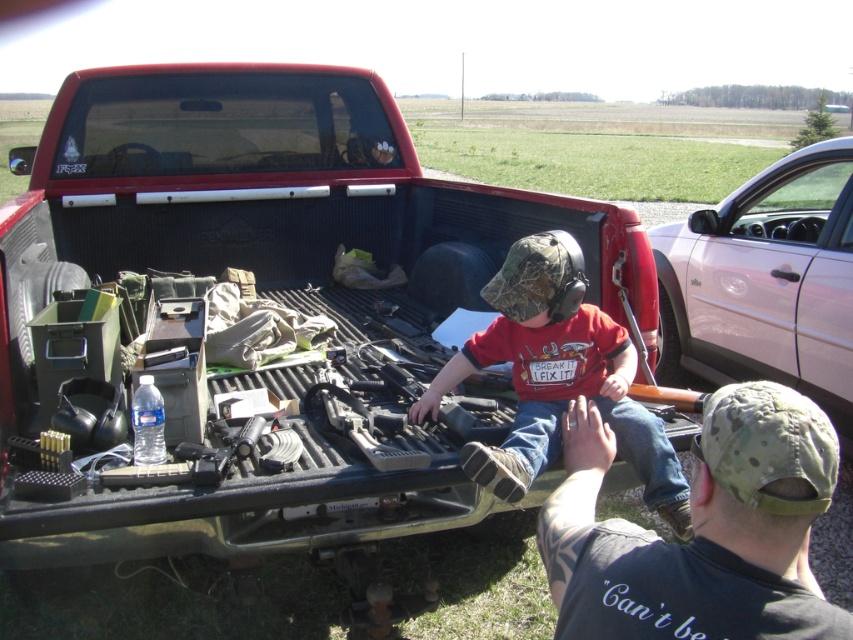
Between metallic silver car at right and camouflage fabric shirt at center, which one has less height?

Standing shorter between the two is camouflage fabric shirt at center.

Is metallic silver car at right to the right of camouflage fabric shirt at center from the viewer's perspective?

Indeed, metallic silver car at right is positioned on the right side of camouflage fabric shirt at center.

I want to click on metallic silver car at right, so click(766, 282).

Where is `metallic silver car at right`? The height and width of the screenshot is (640, 853). metallic silver car at right is located at coordinates (x=766, y=282).

Is camouflage fabric cap at upper right thinner than metallic silver car at right?

Yes.

Who is lower down, camouflage fabric cap at upper right or metallic silver car at right?

camouflage fabric cap at upper right is lower down.

Does point (720, 472) come in front of point (833, 212)?

Yes, point (720, 472) is in front of point (833, 212).

This screenshot has width=853, height=640. I want to click on camouflage fabric cap at upper right, so click(x=699, y=529).

Consider the image. How far apart are camouflage fabric cap at upper right and camouflage fabric shirt at center?

They are 13.32 inches apart.

The image size is (853, 640). What do you see at coordinates (699, 529) in the screenshot?
I see `camouflage fabric cap at upper right` at bounding box center [699, 529].

Is point (762, 557) behind point (582, 308)?

No, (762, 557) is in front of (582, 308).

The width and height of the screenshot is (853, 640). I want to click on camouflage fabric cap at upper right, so click(699, 529).